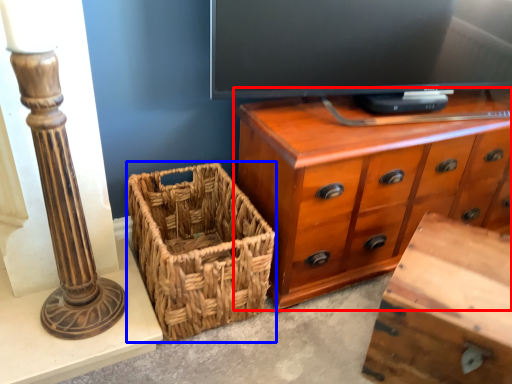
Question: Which object appears farthest to the camera in this image, chest of drawers (highlighted by a red box) or picnic basket (highlighted by a blue box)?

Choices:
 (A) chest of drawers
 (B) picnic basket

Answer: (A)